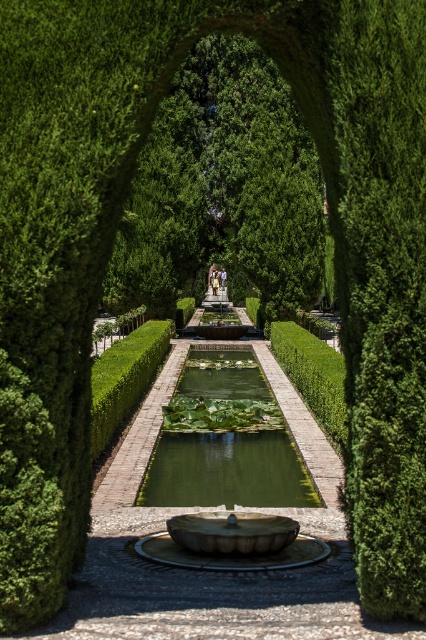
Who is taller, green leafy tree at center or green polished stone hedge at center?

Standing taller between the two is green leafy tree at center.

Looking at this image, is green leafy tree at center smaller than green polished stone hedge at center?

No, green leafy tree at center is not smaller than green polished stone hedge at center.

Which is in front, point (276, 200) or point (118, 390)?

Point (118, 390)

Identify the location of green leafy tree at center. Image resolution: width=426 pixels, height=640 pixels. (222, 189).

Can you confirm if green leafy tree at center is wider than green mossy pond at center?

Correct, the width of green leafy tree at center exceeds that of green mossy pond at center.

Consider the image. Which is more to the right, green leafy tree at center or green mossy pond at center?

Positioned to the right is green mossy pond at center.

Between point (192, 291) and point (290, 502), which one is positioned in front?

Point (290, 502) is in front.

Locate an element on the screen. This screenshot has width=426, height=640. green leafy tree at center is located at coordinates (222, 189).

Is green mossy pond at center closer to the viewer compared to green polished stone hedge at center?

No, it is not.

Does green mossy pond at center have a smaller size compared to green polished stone hedge at center?

Yes.

Locate an element on the screen. This screenshot has width=426, height=640. green mossy pond at center is located at coordinates (226, 468).

The height and width of the screenshot is (640, 426). I want to click on green mossy pond at center, so coord(226,468).